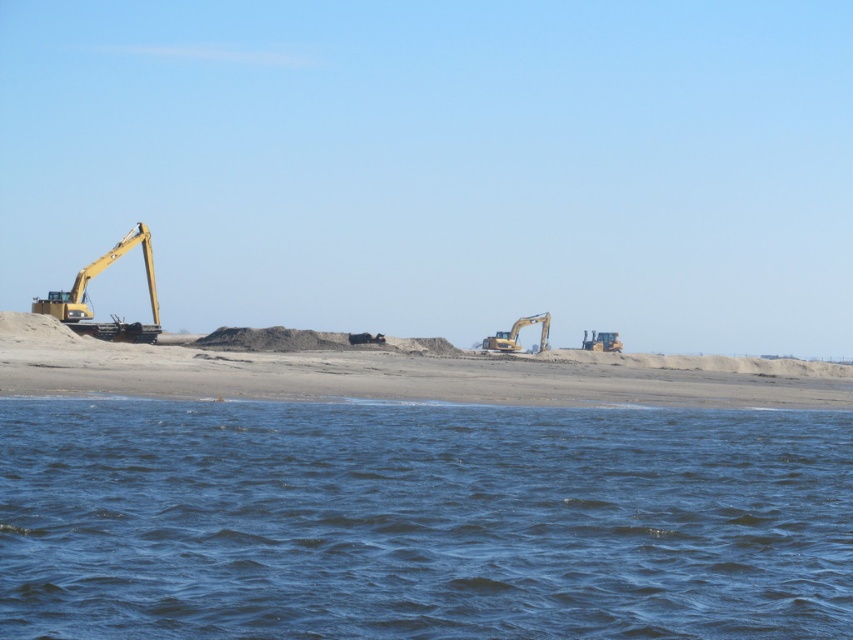
Question: Considering the real-world distances, which object is farthest from the yellow metallic excavator at center?

Choices:
 (A) yellow metallic excavator at center-right
 (B) yellow metallic excavator at left
 (C) blue liquid water at lower center

Answer: (C)

Question: Which point is farther from the camera taking this photo?

Choices:
 (A) (67, 298)
 (B) (753, 388)

Answer: (A)

Question: Which of these objects is positioned closest to the yellow metallic excavator at left?

Choices:
 (A) smooth sand beach at center
 (B) yellow metallic excavator at center-right

Answer: (A)

Question: From the image, what is the correct spatial relationship of smooth sand beach at center in relation to yellow metallic excavator at left?

Choices:
 (A) left
 (B) right

Answer: (B)

Question: Is blue liquid water at lower center to the right of yellow metallic excavator at left from the viewer's perspective?

Choices:
 (A) yes
 (B) no

Answer: (A)

Question: Does smooth sand beach at center have a larger size compared to yellow metallic excavator at center-right?

Choices:
 (A) yes
 (B) no

Answer: (A)